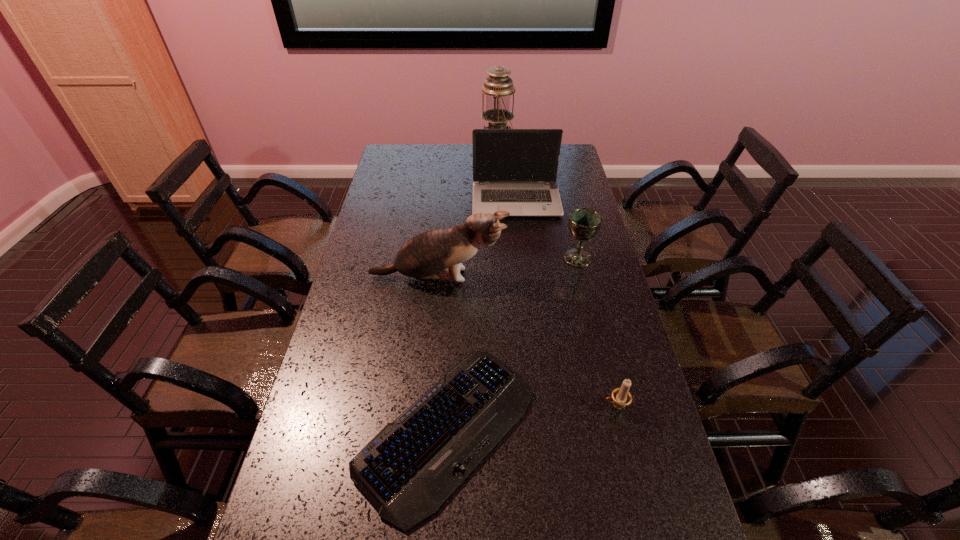
You are a GUI agent. You are given a task and a screenshot of the screen. Output one action in this format:
    pyautogui.click(x=<x>, y=<y>)
    Task: Click on the tallest object
    The image size is (960, 540).
    Given the screenshot: What is the action you would take?
    pyautogui.click(x=498, y=86)

This screenshot has width=960, height=540. I want to click on oil lamp, so click(498, 86).

Locate an element on the screen. cat is located at coordinates (430, 255).

The width and height of the screenshot is (960, 540). Find the location of `the second farthest object`. the second farthest object is located at coordinates (515, 170).

At what (x,y) coordinates should I click in order to perform the action: click on the third shortest object. Please return your answer as a coordinate pair (x, y). This screenshot has height=540, width=960. Looking at the image, I should click on pos(584,223).

Locate an element on the screen. the second shortest object is located at coordinates (621, 397).

At what (x,y) coordinates should I click in order to perform the action: click on computer keyboard. Please return your answer as a coordinate pair (x, y). Looking at the image, I should click on (413, 465).

At what (x,y) coordinates should I click in order to perform the action: click on vacant region located 0.050m on the front of the oil lamp. Please return your answer as a coordinate pair (x, y). Looking at the image, I should click on (499, 167).

You are a GUI agent. You are given a task and a screenshot of the screen. Output one action in this format:
    pyautogui.click(x=<x>, y=<y>)
    Task: Click on the free region located 0.330m at the face of the cat
    This screenshot has width=960, height=540.
    Given the screenshot: What is the action you would take?
    pyautogui.click(x=607, y=277)

This screenshot has width=960, height=540. I want to click on free space located on the screen of the laptop computer, so click(x=519, y=233).